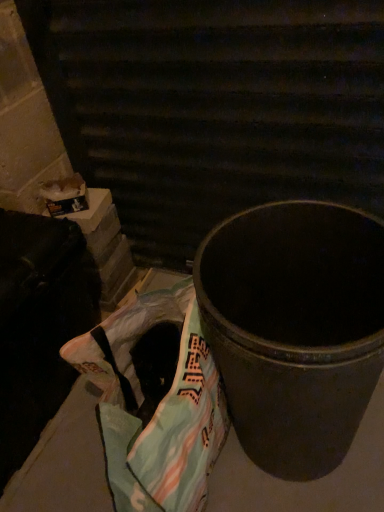
Question: From the image's perspective, relative to metallic black trash can at center, is plastic grocery bag at lower left above or below?

Choices:
 (A) above
 (B) below

Answer: (B)

Question: From a real-world perspective, is plastic grocery bag at lower left positioned above or below metallic black trash can at center?

Choices:
 (A) above
 (B) below

Answer: (B)

Question: Which of these objects is positioned farthest from the plastic grocery bag at lower left?

Choices:
 (A) metallic trash can at center
 (B) metallic black trash can at center

Answer: (B)

Question: Estimate the real-world distances between objects in this image. Which object is closer to the plastic grocery bag at lower left?

Choices:
 (A) metallic black trash can at center
 (B) metallic trash can at center

Answer: (B)